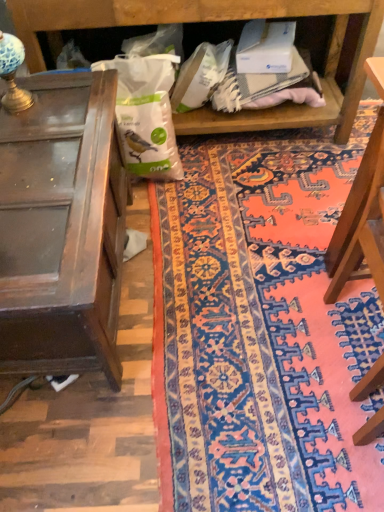
Identify the location of vacant area that lies in front of white matte paper bag at center. The width and height of the screenshot is (384, 512). (163, 204).